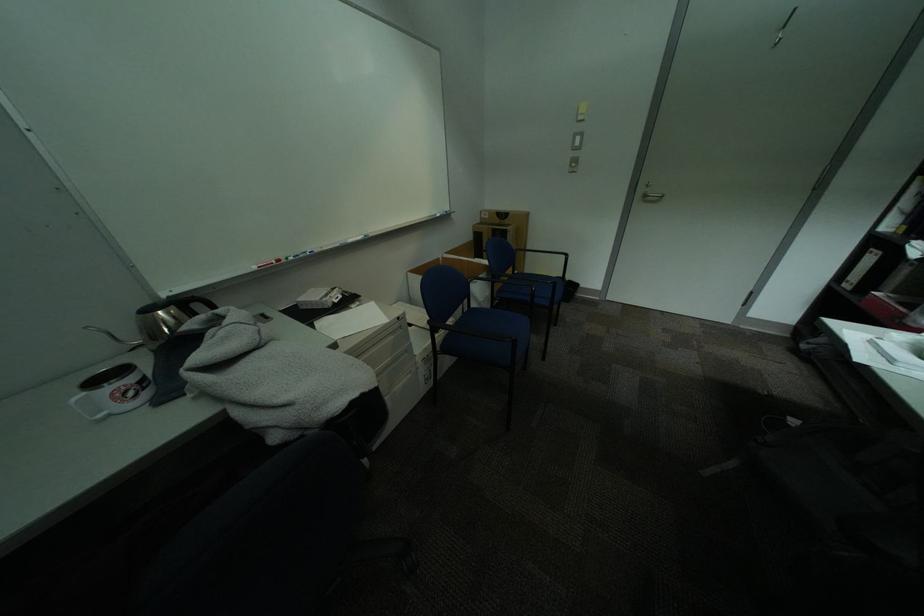
In order to click on red whiteboard marker in this screenshot , I will do `click(266, 262)`.